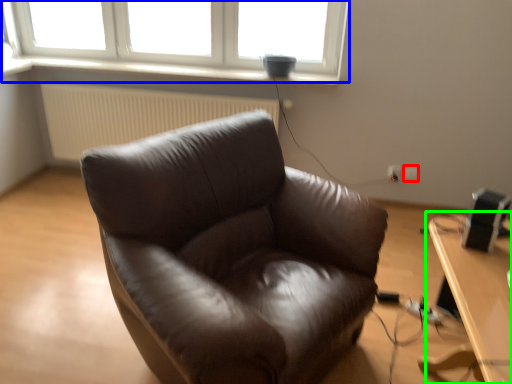
Question: Estimate the real-world distances between objects in this image. Which object is closer to electric outlet (highlighted by a red box), window (highlighted by a blue box) or table (highlighted by a green box)?

Choices:
 (A) window
 (B) table

Answer: (B)